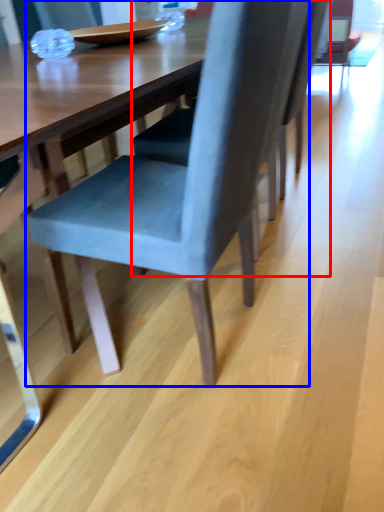
Question: Among these objects, which one is nearest to the camera, chair (highlighted by a red box) or chair (highlighted by a blue box)?

Choices:
 (A) chair
 (B) chair

Answer: (B)